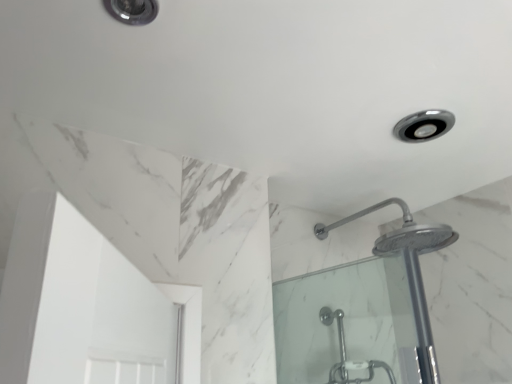
The width and height of the screenshot is (512, 384). Describe the element at coordinates (132, 11) in the screenshot. I see `matte silver light fixture at upper left, placed as the 1th light fixture when sorted from left to right` at that location.

Where is `polished chrome shower head at upper right`? Image resolution: width=512 pixels, height=384 pixels. polished chrome shower head at upper right is located at coordinates (408, 269).

You are a GUI agent. You are given a task and a screenshot of the screen. Output one action in this format:
    pyautogui.click(x=<x>, y=<y>)
    Task: Click on the matte silver light fixture at upper left, the second light fixture positioned from the bottom
    The image size is (512, 384).
    Given the screenshot: What is the action you would take?
    pyautogui.click(x=132, y=11)

Which is more to the left, polished chrome shower head at upper right or matte silver light fixture at upper left, the second light fixture positioned from the bottom?

matte silver light fixture at upper left, the second light fixture positioned from the bottom, is more to the left.

Is polished chrome shower head at upper right positioned with its back to matte silver light fixture at upper left, the first light fixture viewed from the front?

No, polished chrome shower head at upper right is not facing away from matte silver light fixture at upper left, the first light fixture viewed from the front.

Is polished chrome shower head at upper right shorter than matte silver light fixture at upper left, the second light fixture from the right?

No, polished chrome shower head at upper right is not shorter than matte silver light fixture at upper left, the second light fixture from the right.

Does satin nickel light fixture at upper right, the 2th light fixture when ordered from front to back, appear on the right side of matte silver light fixture at upper left, the second light fixture viewed from the back?

Yes, satin nickel light fixture at upper right, the 2th light fixture when ordered from front to back, is to the right of matte silver light fixture at upper left, the second light fixture viewed from the back.

What's the angular difference between satin nickel light fixture at upper right, arranged as the first light fixture when viewed from the back, and matte silver light fixture at upper left, placed as the 1th light fixture when sorted from left to right,'s facing directions?

satin nickel light fixture at upper right, arranged as the first light fixture when viewed from the back, and matte silver light fixture at upper left, placed as the 1th light fixture when sorted from left to right, are facing 90 degrees away from each other.

Which object is further away from the camera, satin nickel light fixture at upper right, arranged as the first light fixture when viewed from the back, or matte silver light fixture at upper left, the second light fixture viewed from the back?

Positioned behind is satin nickel light fixture at upper right, arranged as the first light fixture when viewed from the back.

Which is behind, point (443, 121) or point (119, 20)?

The point (443, 121) is more distant.

Which is more to the left, matte silver light fixture at upper left, the second light fixture from the right, or polished chrome shower head at upper right?

matte silver light fixture at upper left, the second light fixture from the right, is more to the left.

Is matte silver light fixture at upper left, the second light fixture from the right, positioned beyond the bounds of polished chrome shower head at upper right?

Absolutely, matte silver light fixture at upper left, the second light fixture from the right, is external to polished chrome shower head at upper right.

Measure the distance from matte silver light fixture at upper left, which appears as the first light fixture when viewed from the top, to polished chrome shower head at upper right.

matte silver light fixture at upper left, which appears as the first light fixture when viewed from the top, is 30.36 inches away from polished chrome shower head at upper right.

Who is smaller, matte silver light fixture at upper left, the second light fixture from the right, or polished chrome shower head at upper right?

Smaller between the two is matte silver light fixture at upper left, the second light fixture from the right.

Locate an element on the screen. light fixture behind the polished chrome shower head at upper right is located at coordinates (424, 126).

Considering the sizes of satin nickel light fixture at upper right, the 2th light fixture when ordered from front to back, and polished chrome shower head at upper right in the image, is satin nickel light fixture at upper right, the 2th light fixture when ordered from front to back, wider or thinner than polished chrome shower head at upper right?

Considering their sizes, satin nickel light fixture at upper right, the 2th light fixture when ordered from front to back, looks slimmer than polished chrome shower head at upper right.

In the scene shown: Which point is more distant from viewer, (428, 117) or (425, 317)?

The point (428, 117) is farther.

Are satin nickel light fixture at upper right, which ranks as the 1th light fixture in bottom-to-top order, and polished chrome shower head at upper right far apart?

That's not correct — satin nickel light fixture at upper right, which ranks as the 1th light fixture in bottom-to-top order, is a little close to polished chrome shower head at upper right.

The image size is (512, 384). Find the location of `light fixture on the right of matte silver light fixture at upper left, the second light fixture from the right`. light fixture on the right of matte silver light fixture at upper left, the second light fixture from the right is located at coordinates (424, 126).

Is matte silver light fixture at upper left, placed as the 1th light fixture when sorted from left to right, in front of or behind satin nickel light fixture at upper right, arranged as the first light fixture when viewed from the back, in the image?

Visually, matte silver light fixture at upper left, placed as the 1th light fixture when sorted from left to right, is located in front of satin nickel light fixture at upper right, arranged as the first light fixture when viewed from the back.

Is point (113, 4) positioned before point (428, 134)?

Yes.

Looking at this image, does matte silver light fixture at upper left, which appears as the first light fixture when viewed from the top, appear on the left side of satin nickel light fixture at upper right, arranged as the first light fixture when viewed from the back?

Correct, you'll find matte silver light fixture at upper left, which appears as the first light fixture when viewed from the top, to the left of satin nickel light fixture at upper right, arranged as the first light fixture when viewed from the back.

Which point is more distant from viewer, (390, 240) or (414, 134)?

The point (390, 240) is behind.

From the image's perspective, would you say polished chrome shower head at upper right is positioned over satin nickel light fixture at upper right, arranged as the first light fixture when viewed from the back?

No, from the image's perspective, polished chrome shower head at upper right is not above satin nickel light fixture at upper right, arranged as the first light fixture when viewed from the back.

Between polished chrome shower head at upper right and satin nickel light fixture at upper right, which is counted as the 2th light fixture, starting from the top, which one has smaller width?

satin nickel light fixture at upper right, which is counted as the 2th light fixture, starting from the top, is thinner.

From the image's perspective, which light fixture is the 1st one above the polished chrome shower head at upper right? Please provide its 2D coordinates.

[(424, 126)]

Identify the location of shower below the matte silver light fixture at upper left, the second light fixture positioned from the bottom (from the image's perspective). (408, 269).

Where is `light fixture located above the satin nickel light fixture at upper right, which ranks as the 1th light fixture in bottom-to-top order (from a real-world perspective)`? The width and height of the screenshot is (512, 384). light fixture located above the satin nickel light fixture at upper right, which ranks as the 1th light fixture in bottom-to-top order (from a real-world perspective) is located at coordinates (132, 11).

Estimate the real-world distances between objects in this image. Which object is closer to polished chrome shower head at upper right, satin nickel light fixture at upper right, arranged as the first light fixture when viewed from the back, or matte silver light fixture at upper left, the second light fixture positioned from the bottom?

satin nickel light fixture at upper right, arranged as the first light fixture when viewed from the back, is closer to polished chrome shower head at upper right.

Estimate the real-world distances between objects in this image. Which object is closer to polished chrome shower head at upper right, matte silver light fixture at upper left, placed as the 1th light fixture when sorted from left to right, or satin nickel light fixture at upper right, which ranks as the 1th light fixture in bottom-to-top order?

The object closer to polished chrome shower head at upper right is satin nickel light fixture at upper right, which ranks as the 1th light fixture in bottom-to-top order.

When comparing their distances from matte silver light fixture at upper left, the second light fixture viewed from the back, does polished chrome shower head at upper right or satin nickel light fixture at upper right, arranged as the first light fixture when viewed from the back, seem further?

polished chrome shower head at upper right.

Based on their spatial positions, is matte silver light fixture at upper left, which appears as the first light fixture when viewed from the top, or polished chrome shower head at upper right closer to satin nickel light fixture at upper right, the 2th light fixture when ordered from front to back?

polished chrome shower head at upper right lies closer to satin nickel light fixture at upper right, the 2th light fixture when ordered from front to back, than the other object.

Which object lies further to the anchor point satin nickel light fixture at upper right, arranged as the first light fixture when viewed from the back, polished chrome shower head at upper right or matte silver light fixture at upper left, placed as the 1th light fixture when sorted from left to right?

matte silver light fixture at upper left, placed as the 1th light fixture when sorted from left to right, lies further to satin nickel light fixture at upper right, arranged as the first light fixture when viewed from the back, than the other object.

Which object lies nearer to the anchor point matte silver light fixture at upper left, the first light fixture viewed from the front, satin nickel light fixture at upper right, the 2th light fixture when ordered from front to back, or polished chrome shower head at upper right?

Among the two, satin nickel light fixture at upper right, the 2th light fixture when ordered from front to back, is located nearer to matte silver light fixture at upper left, the first light fixture viewed from the front.

The width and height of the screenshot is (512, 384). What are the coordinates of `shower between matte silver light fixture at upper left, which appears as the first light fixture when viewed from the top, and satin nickel light fixture at upper right, which appears as the 1th light fixture when viewed from the right, from left to right` in the screenshot? It's located at (408, 269).